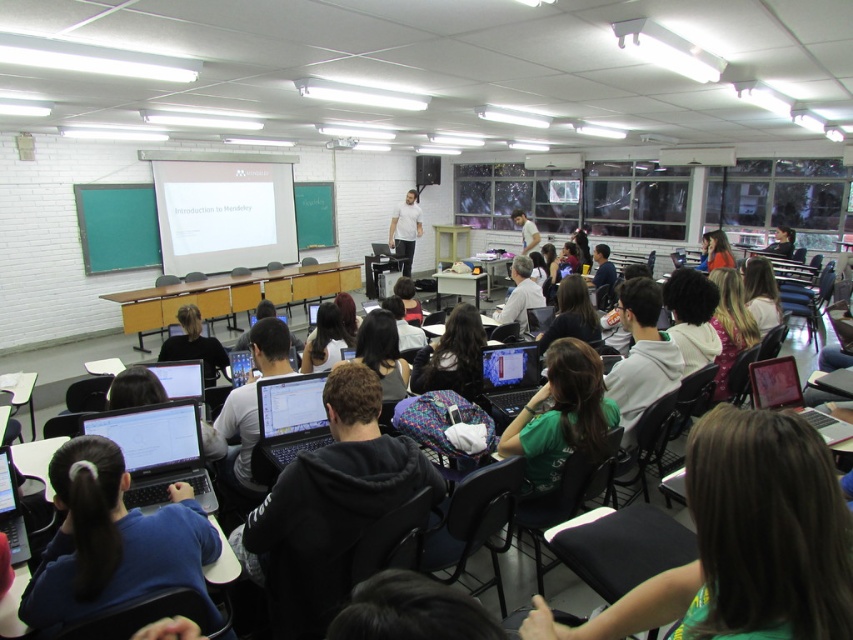
Question: Which object is closer to the camera taking this photo?

Choices:
 (A) satin black laptop at lower left
 (B) satin black laptop at center

Answer: (A)

Question: Based on their relative distances, which object is farther from the satin black laptop at lower left?

Choices:
 (A) black matte laptop at center
 (B) black matte shirt at center

Answer: (B)

Question: Which object is positioned closest to the black matte shirt at center?

Choices:
 (A) matte black laptop at lower left
 (B) shiny black laptop at center
 (C) satin black laptop at lower left
 (D) green matte shirt at center

Answer: (B)

Question: Does black matte shirt at center have a greater width compared to white shirt at center?

Choices:
 (A) yes
 (B) no

Answer: (A)

Question: Is matte black laptop at lower left below black glossy laptop at lower left?

Choices:
 (A) no
 (B) yes

Answer: (A)

Question: Is matte black laptop at lower left further to camera compared to black glossy laptop at lower left?

Choices:
 (A) yes
 (B) no

Answer: (B)